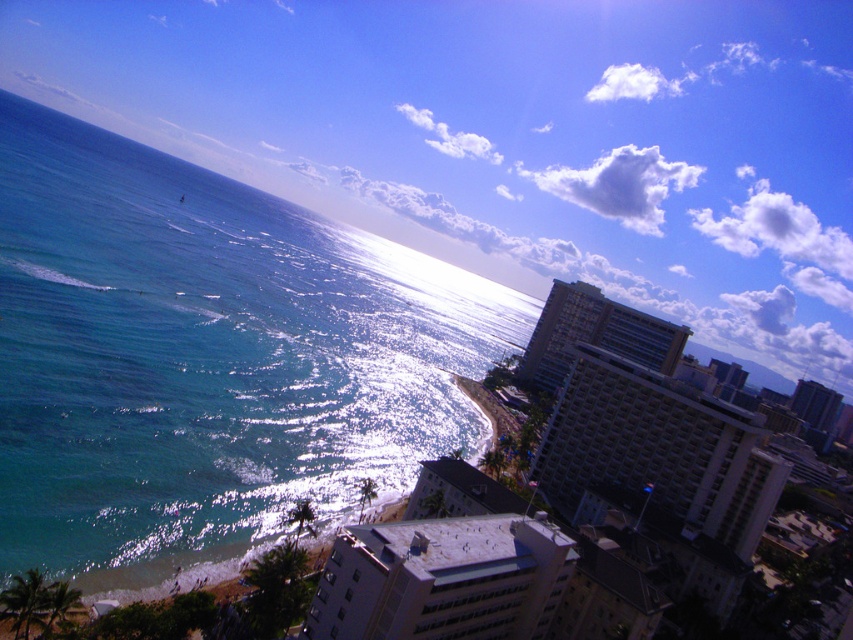
Question: Estimate the real-world distances between objects in this image. Which object is closer to the blue glossy water at left?

Choices:
 (A) gray concrete building at center
 (B) white glossy building at center

Answer: (A)

Question: Can you confirm if blue glossy water at left is positioned to the left of white glossy building at center?

Choices:
 (A) no
 (B) yes

Answer: (B)

Question: Among these points, which one is farthest from the camera?

Choices:
 (A) (549, 323)
 (B) (102, 528)
 (C) (693, 516)

Answer: (A)

Question: Is blue glossy water at left closer to camera compared to white glossy building at center?

Choices:
 (A) yes
 (B) no

Answer: (A)

Question: Is white glossy building at center to the right of gray concrete building at center from the viewer's perspective?

Choices:
 (A) no
 (B) yes

Answer: (A)

Question: Which point appears farthest from the camera in this image?

Choices:
 (A) (711, 406)
 (B) (15, 417)
 (C) (608, 321)

Answer: (C)